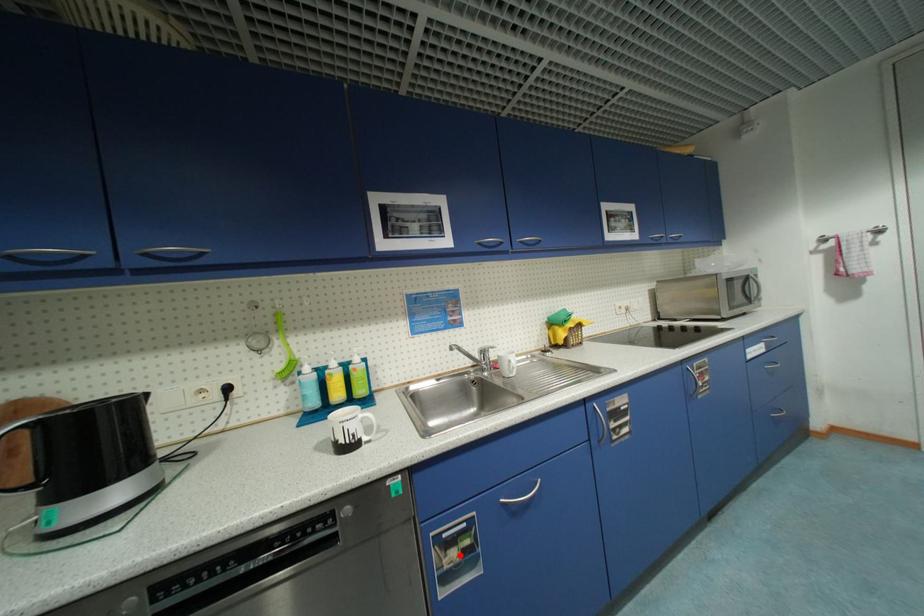
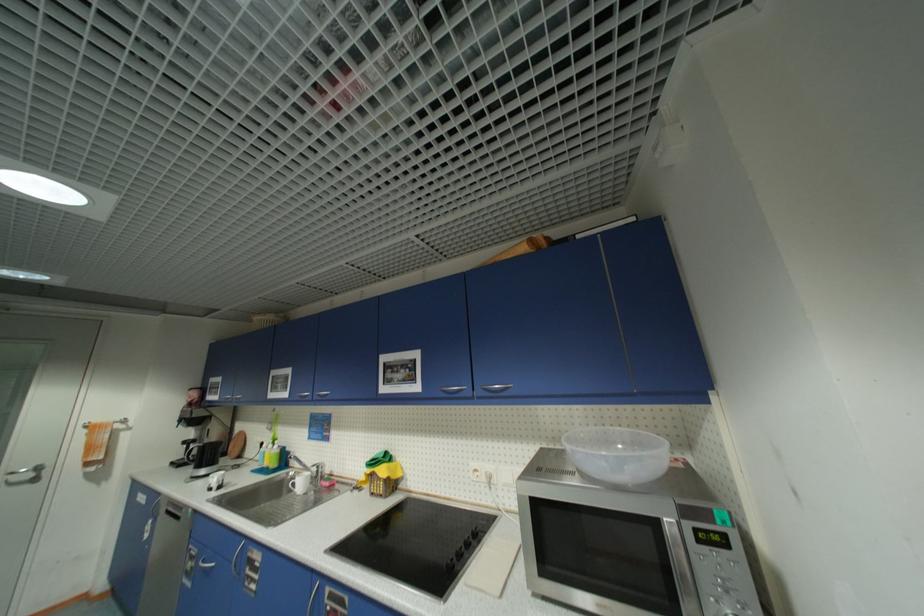
Locate, in the second image, the point that corresponds to the highlighted location in the first image.

(196, 565)